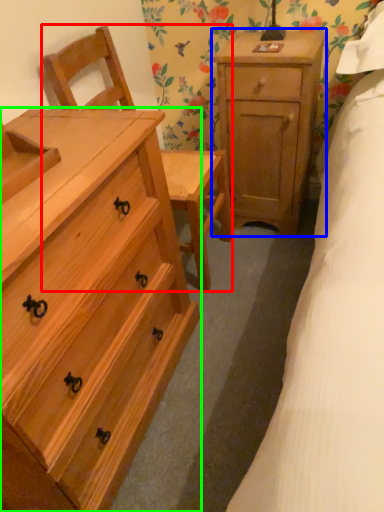
Question: Considering the real-world distances, which object is closest to armchair (highlighted by a red box)? nightstand (highlighted by a blue box) or chest of drawers (highlighted by a green box).

Choices:
 (A) nightstand
 (B) chest of drawers

Answer: (A)